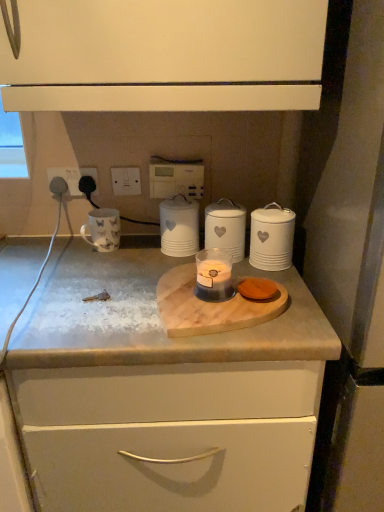
Question: From a real-world perspective, is black plastic socket at upper left, the 2th electric outlet from the right, located beneath white plastic switch at upper center, positioned as the 3th electric outlet in left-to-right order?

Choices:
 (A) yes
 (B) no

Answer: (A)

Question: Does black plastic socket at upper left, the 2th electric outlet from the right, have a greater width compared to white plastic switch at upper center, the first electric outlet in the right-to-left sequence?

Choices:
 (A) yes
 (B) no

Answer: (A)

Question: Is black plastic socket at upper left, positioned as the second electric outlet in left-to-right order, in contact with white plastic switch at upper center, the first electric outlet in the right-to-left sequence?

Choices:
 (A) no
 (B) yes

Answer: (B)

Question: From the image's perspective, is black plastic socket at upper left, positioned as the second electric outlet in left-to-right order, over white plastic switch at upper center, positioned as the 3th electric outlet in left-to-right order?

Choices:
 (A) yes
 (B) no

Answer: (B)

Question: Is black plastic socket at upper left, positioned as the second electric outlet in left-to-right order, to the left of white plastic switch at upper center, positioned as the 3th electric outlet in left-to-right order, from the viewer's perspective?

Choices:
 (A) yes
 (B) no

Answer: (A)

Question: Choose the correct answer: Is white plastic switch at upper center, positioned as the 3th electric outlet in left-to-right order, inside white plastic socket at upper left, positioned as the third electric outlet in right-to-left order, or outside it?

Choices:
 (A) inside
 (B) outside

Answer: (B)

Question: Considering the positions of white plastic switch at upper center, the first electric outlet in the right-to-left sequence, and white plastic socket at upper left, the 1th electric outlet viewed from the left, in the image, is white plastic switch at upper center, the first electric outlet in the right-to-left sequence, taller or shorter than white plastic socket at upper left, the 1th electric outlet viewed from the left,?

Choices:
 (A) short
 (B) tall

Answer: (A)

Question: From the image's perspective, relative to white plastic socket at upper left, positioned as the third electric outlet in right-to-left order, is white plastic switch at upper center, positioned as the 3th electric outlet in left-to-right order, above or below?

Choices:
 (A) below
 (B) above

Answer: (B)

Question: Visually, is white plastic switch at upper center, the first electric outlet in the right-to-left sequence, positioned to the left or to the right of white plastic socket at upper left, the 1th electric outlet viewed from the left?

Choices:
 (A) right
 (B) left

Answer: (A)

Question: From the image's perspective, is white plastic switch at upper center, positioned as the 3th electric outlet in left-to-right order, above or below white textured canister at center, acting as the 2th home appliance starting from the left?

Choices:
 (A) below
 (B) above

Answer: (B)

Question: Considering the positions of white plastic switch at upper center, positioned as the 3th electric outlet in left-to-right order, and white textured canister at center, acting as the 2th home appliance starting from the left, in the image, is white plastic switch at upper center, positioned as the 3th electric outlet in left-to-right order, bigger or smaller than white textured canister at center, acting as the 2th home appliance starting from the left,?

Choices:
 (A) big
 (B) small

Answer: (B)

Question: Relative to white textured canister at center, acting as the 2th home appliance starting from the left, is white plastic switch at upper center, the first electric outlet in the right-to-left sequence, in front or behind?

Choices:
 (A) front
 (B) behind

Answer: (B)

Question: Based on their positions, is white plastic switch at upper center, positioned as the 3th electric outlet in left-to-right order, located to the left or right of white textured canister at center, acting as the 2th home appliance starting from the left?

Choices:
 (A) right
 (B) left

Answer: (B)

Question: In the image, is translucent glass candle at center on the left side or the right side of black plastic socket at upper left, positioned as the second electric outlet in left-to-right order?

Choices:
 (A) right
 (B) left

Answer: (A)

Question: Is translucent glass candle at center in front of or behind black plastic socket at upper left, positioned as the second electric outlet in left-to-right order, in the image?

Choices:
 (A) front
 (B) behind

Answer: (A)